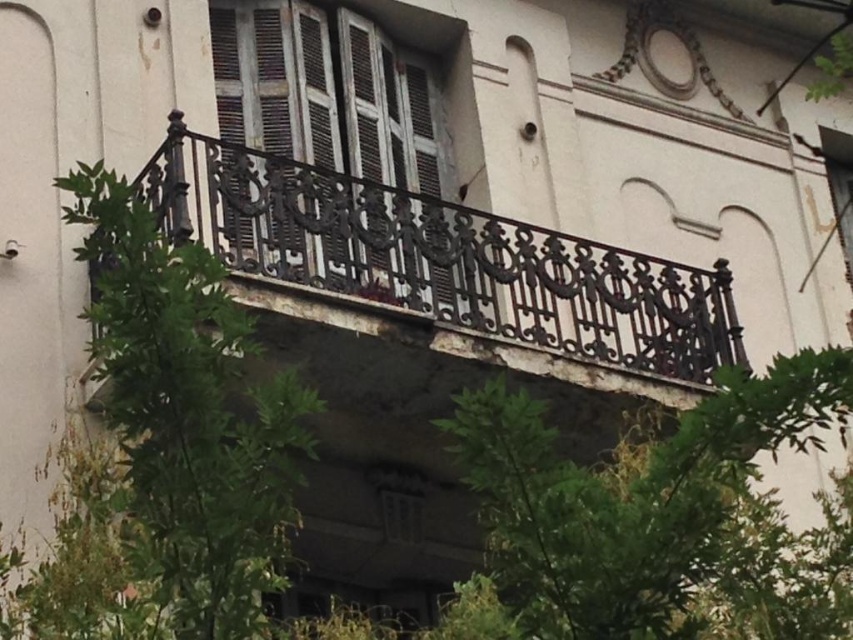
Question: Which of the following is the farthest from the observer?

Choices:
 (A) (410, 140)
 (B) (653, 586)

Answer: (A)

Question: Is rusty metal balustrade at upper center to the right of green leafy tree at lower left from the viewer's perspective?

Choices:
 (A) no
 (B) yes

Answer: (B)

Question: In this image, where is green leafy tree at center located relative to green leafy tree at lower left?

Choices:
 (A) right
 (B) left

Answer: (A)

Question: Which of the following is the closest to the observer?

Choices:
 (A) green leafy tree at lower left
 (B) green leafy tree at center

Answer: (B)

Question: Can you confirm if rusty metal balustrade at upper center is positioned below green leafy tree at center?

Choices:
 (A) yes
 (B) no

Answer: (B)

Question: Which point is closer to the camera?

Choices:
 (A) (611, 371)
 (B) (392, 93)
 (C) (202, 481)
 (D) (624, 547)

Answer: (D)